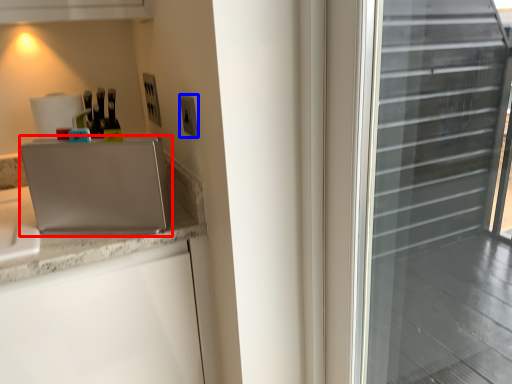
Question: Which object appears closest to the camera in this image, appliance (highlighted by a red box) or electric outlet (highlighted by a blue box)?

Choices:
 (A) appliance
 (B) electric outlet

Answer: (A)